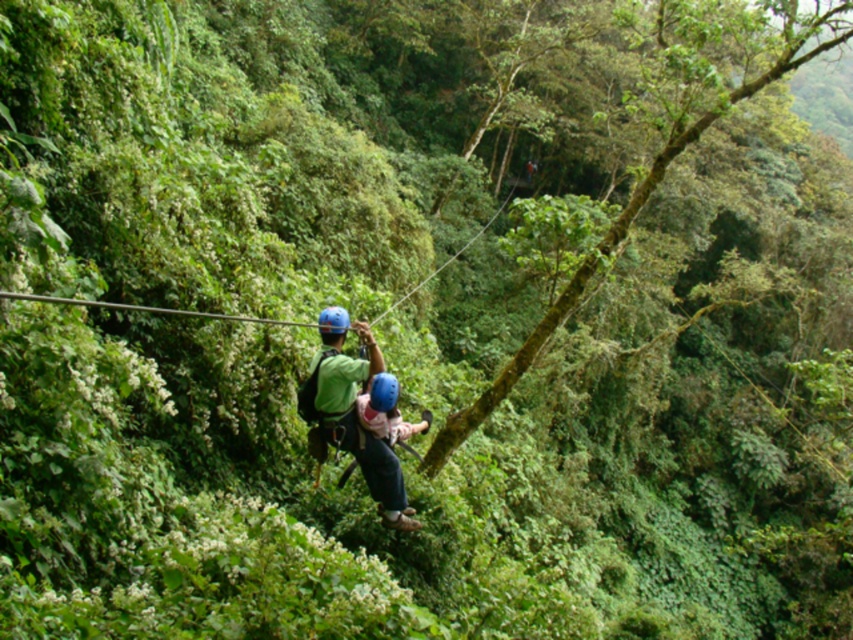
Between point (341, 358) and point (369, 403), which one is positioned behind?

The point (341, 358) is behind.

Can you confirm if green fabric harness at center is thinner than blue matte helmet at center?

Incorrect, green fabric harness at center's width is not less than blue matte helmet at center's.

Identify the location of green fabric harness at center. (351, 413).

At what (x,y) coordinates should I click in order to perform the action: click on green fabric harness at center. Please return your answer as a coordinate pair (x, y). The height and width of the screenshot is (640, 853). Looking at the image, I should click on (351, 413).

Which is more to the left, green mossy tree at center or green fabric harness at center?

Positioned to the left is green fabric harness at center.

Can you confirm if green mossy tree at center is taller than green fabric harness at center?

Indeed, green mossy tree at center has a greater height compared to green fabric harness at center.

You are a GUI agent. You are given a task and a screenshot of the screen. Output one action in this format:
    pyautogui.click(x=<x>, y=<y>)
    Task: Click on the green mossy tree at center
    
    Given the screenshot: What is the action you would take?
    pyautogui.click(x=619, y=240)

At what (x,y) coordinates should I click in order to perform the action: click on green mossy tree at center. Please return your answer as a coordinate pair (x, y). Looking at the image, I should click on (619, 240).

Is the position of green mossy tree at center more distant than that of blue matte helmet at center?

Yes, green mossy tree at center is further from the viewer.

Does green mossy tree at center lie in front of blue matte helmet at center?

No, green mossy tree at center is further to the viewer.

Which is in front, point (436, 472) or point (393, 378)?

Point (393, 378)

This screenshot has height=640, width=853. In order to click on green mossy tree at center in this screenshot , I will do `click(619, 240)`.